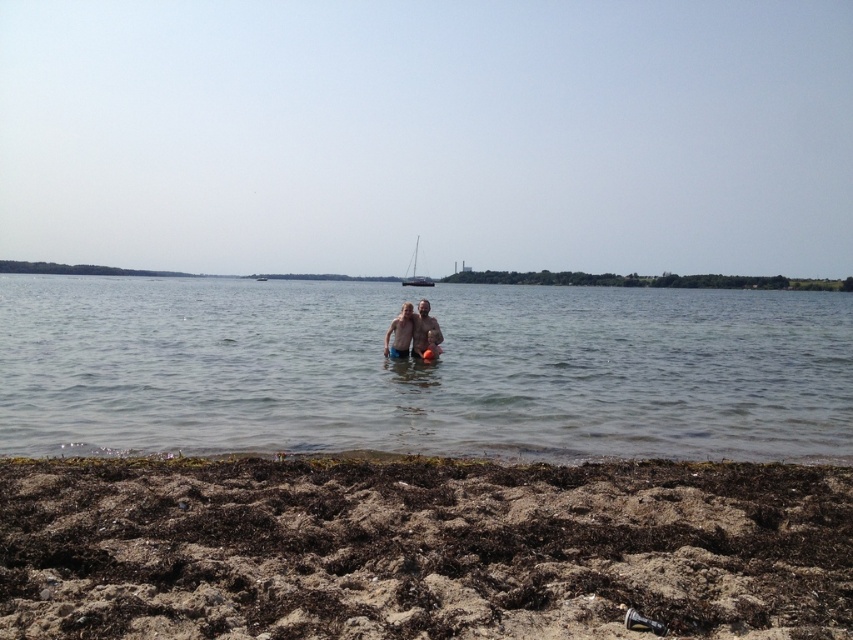
Consider the image. Is smooth skin couple at center above smooth skin at center?

No, smooth skin couple at center is not above smooth skin at center.

Which is below, smooth skin couple at center or smooth skin at center?

smooth skin couple at center

Identify the location of smooth skin couple at center. Image resolution: width=853 pixels, height=640 pixels. 412,332.

Can you confirm if brown sandy beach at lower center is taller than white matte sailboat at center?

No.

Is brown sandy beach at lower center further to the viewer compared to white matte sailboat at center?

No, brown sandy beach at lower center is in front of white matte sailboat at center.

Find the location of a particular element. brown sandy beach at lower center is located at coordinates (421, 548).

I want to click on brown sandy beach at lower center, so click(421, 548).

Does clear water at center appear under smooth skin at center?

Incorrect, clear water at center is not positioned below smooth skin at center.

Is clear water at center to the left of smooth skin at center from the viewer's perspective?

No, clear water at center is not to the left of smooth skin at center.

You are a GUI agent. You are given a task and a screenshot of the screen. Output one action in this format:
    pyautogui.click(x=<x>, y=<y>)
    Task: Click on the clear water at center
    
    Given the screenshot: What is the action you would take?
    pyautogui.click(x=421, y=369)